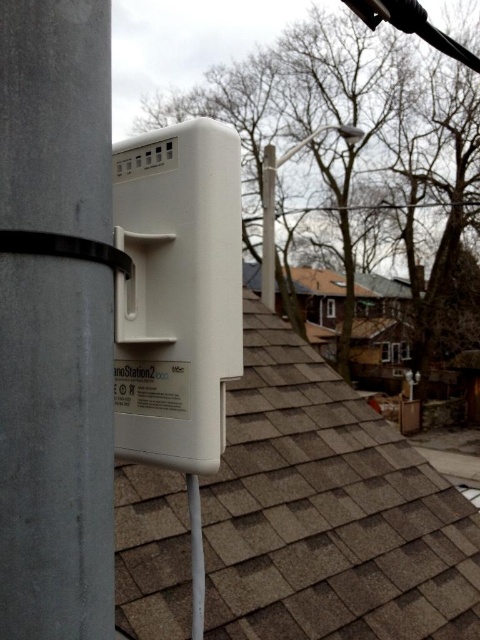
Question: Is brown shingles at center behind white plastic lamp post at upper center?

Choices:
 (A) no
 (B) yes

Answer: (A)

Question: Is white plastic pole at center above white plastic lamp post at upper center?

Choices:
 (A) no
 (B) yes

Answer: (A)

Question: Which point appears farthest from the camera in this image?

Choices:
 (A) (275, 161)
 (B) (406, 628)
 (C) (60, 308)

Answer: (A)

Question: Is white plastic pole at center bigger than white plastic lamp post at upper center?

Choices:
 (A) yes
 (B) no

Answer: (B)

Question: Which object appears farthest from the camera in this image?

Choices:
 (A) white plastic pole at center
 (B) white plastic lamp post at upper center

Answer: (B)

Question: Which of the following is the farthest from the observer?

Choices:
 (A) brown shingles at center
 (B) white plastic pole at center
 (C) white plastic lamp post at upper center

Answer: (C)